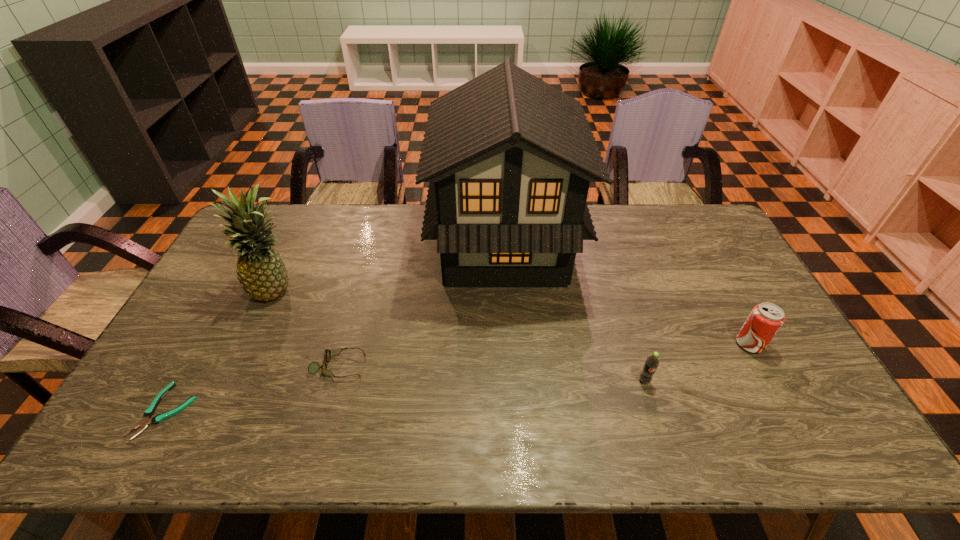
Locate an element on the screen. Image resolution: width=960 pixels, height=540 pixels. vacant space in between the spectacles and the fifth object from left to right is located at coordinates (492, 373).

Locate an element on the screen. The width and height of the screenshot is (960, 540). empty space between the pliers and the tallest object is located at coordinates (335, 328).

Where is `unoccupied position between the dollhouse and the pliers`? This screenshot has height=540, width=960. unoccupied position between the dollhouse and the pliers is located at coordinates (x=335, y=328).

I want to click on free space between the taller soda and the spectacles, so click(544, 355).

In order to click on free space between the fourth tallest object and the fifth tallest object in this screenshot , I will do `click(492, 373)`.

Image resolution: width=960 pixels, height=540 pixels. Find the location of `unoccupied area between the nearer soda and the right soda`. unoccupied area between the nearer soda and the right soda is located at coordinates (697, 362).

At what (x,y) coordinates should I click in order to perform the action: click on vacant area that lies between the shorter soda and the pliers. Please return your answer as a coordinate pair (x, y). This screenshot has height=540, width=960. Looking at the image, I should click on (405, 395).

Find the location of a particular element. Image resolution: width=960 pixels, height=540 pixels. vacant space in between the fifth shortest object and the rightmost object is located at coordinates coord(514,317).

This screenshot has width=960, height=540. I want to click on free space between the rightmost object and the second tallest object, so click(x=514, y=317).

This screenshot has width=960, height=540. In order to click on free space between the left soda and the fourth object from right to left in this screenshot , I will do `click(492, 373)`.